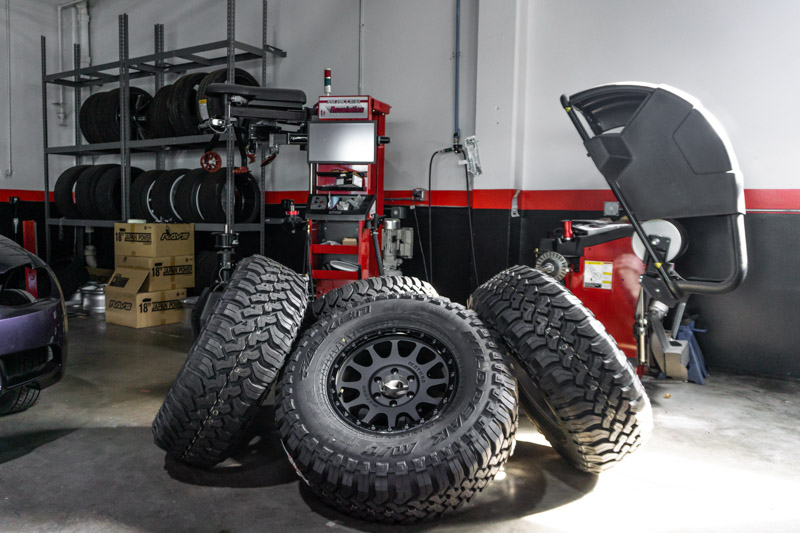
Locate an element on the screen. wall pipes is located at coordinates (453, 60), (470, 51).